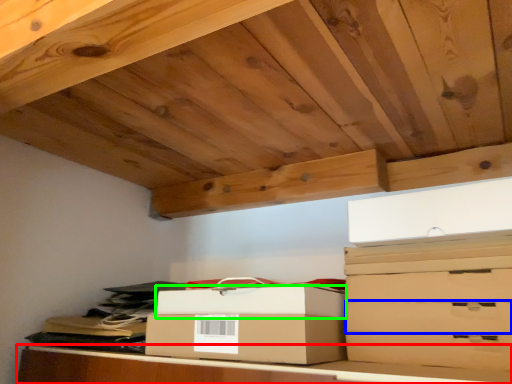
Question: Based on their relative distances, which object is nearer to furniture (highlighted by a red box)? Choose from drawer (highlighted by a blue box) and box (highlighted by a green box).

Choices:
 (A) drawer
 (B) box

Answer: (B)